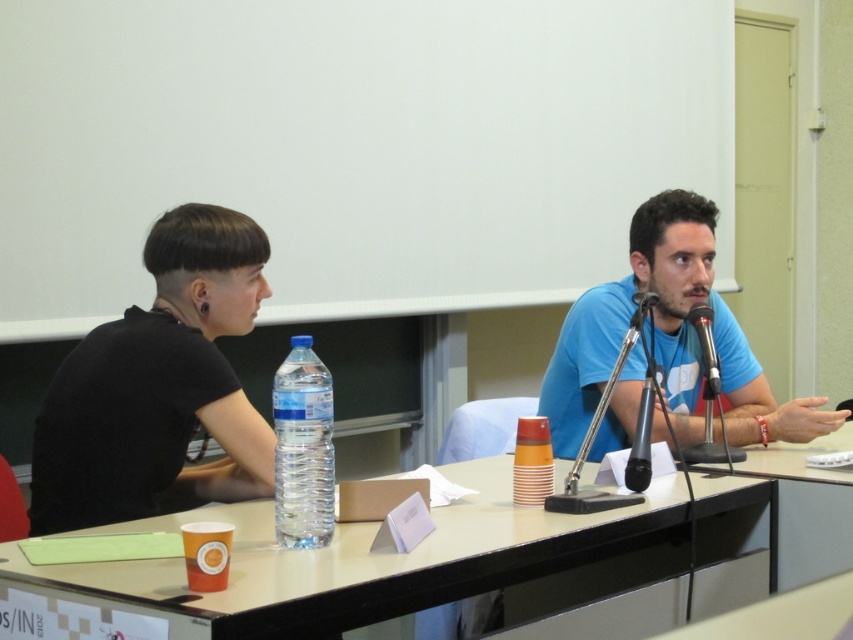
Question: Is smooth black table at center thinner than black plastic table at center?

Choices:
 (A) yes
 (B) no

Answer: (B)

Question: Is blue matte shirt at center below smooth plastic table at center?

Choices:
 (A) no
 (B) yes

Answer: (A)

Question: Based on their relative distances, which object is farther from the black matte shirt at left?

Choices:
 (A) smooth black table at center
 (B) black plastic table at center
 (C) clear plastic bottle at center

Answer: (B)

Question: Which object is the farthest from the blue matte shirt at center?

Choices:
 (A) black plastic table at center
 (B) smooth plastic table at center
 (C) smooth black table at center
 (D) clear plastic bottle at center

Answer: (D)

Question: Is black glossy microphone at center wider than black metallic microphone at center?

Choices:
 (A) no
 (B) yes

Answer: (A)

Question: Considering the real-world distances, which object is closest to the black glossy microphone at center?

Choices:
 (A) black matte shirt at left
 (B) smooth black table at center
 (C) blue matte shirt at center

Answer: (B)